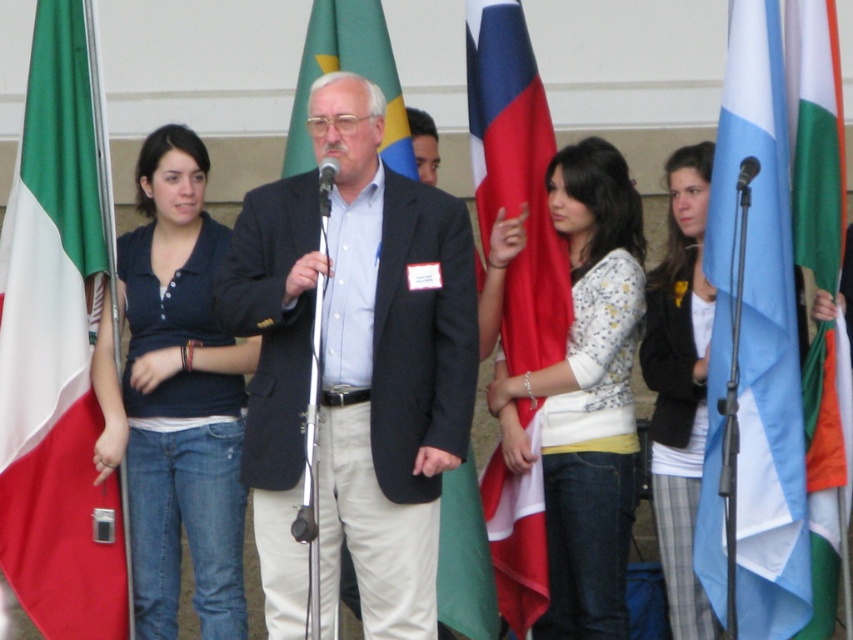
Question: Which of the following is the closest to the observer?

Choices:
 (A) metallic silver microphone at center
 (B) blue fabric flag at center

Answer: (A)

Question: Is green fabric flag at left below black textured blazer at center?

Choices:
 (A) no
 (B) yes

Answer: (A)

Question: Which of the following is the farthest from the observer?

Choices:
 (A) (799, 12)
 (B) (149, 520)
 (C) (712, 378)
 (D) (672, 168)

Answer: (D)

Question: Does matte black suit at center appear over black plastic microphone at center?

Choices:
 (A) no
 (B) yes

Answer: (A)

Question: Which point is farther to the camera?

Choices:
 (A) (325, 173)
 (B) (807, 196)
 (C) (90, 493)
 (D) (347, 244)

Answer: (C)

Question: Can you confirm if blue fabric flag at center is thinner than metallic silver microphone at center?

Choices:
 (A) no
 (B) yes

Answer: (A)